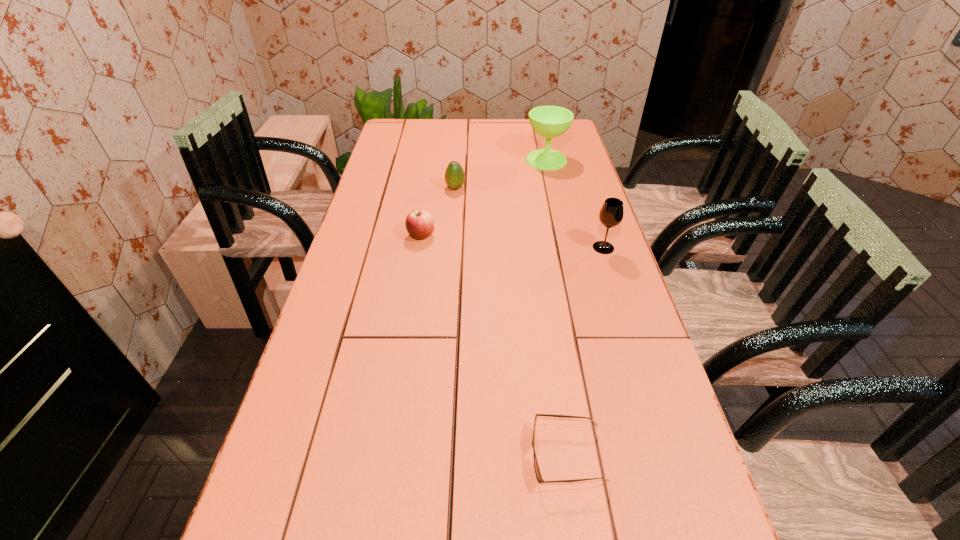
Where is `free space located on the back of the second object from left to right`? This screenshot has height=540, width=960. free space located on the back of the second object from left to right is located at coordinates (459, 146).

Find the location of `vacant space located 0.120m on the front of the apple`. vacant space located 0.120m on the front of the apple is located at coordinates (416, 271).

I want to click on free point located 0.340m on the lenses of the shortest object, so click(353, 455).

Where is `free location located 0.320m on the lenses of the shortest object`? The width and height of the screenshot is (960, 540). free location located 0.320m on the lenses of the shortest object is located at coordinates (363, 455).

Locate an element on the screen. The width and height of the screenshot is (960, 540). vacant area situated on the lenses of the shortest object is located at coordinates (474, 455).

Identify the location of sunglasses present at the right edge. click(536, 467).

Find the location of a particular element. free space at the far edge is located at coordinates (450, 128).

Image resolution: width=960 pixels, height=540 pixels. Identify the location of free space at the left edge of the desktop. (369, 241).

In the image, there is a desktop. Identify the location of free space at the right edge. (564, 215).

I want to click on blank area at the far left corner, so click(408, 127).